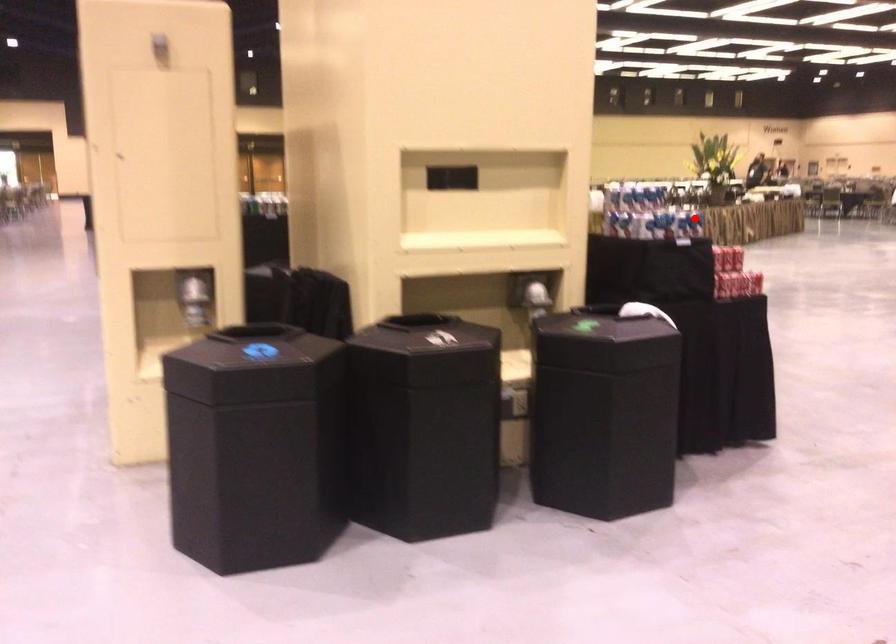
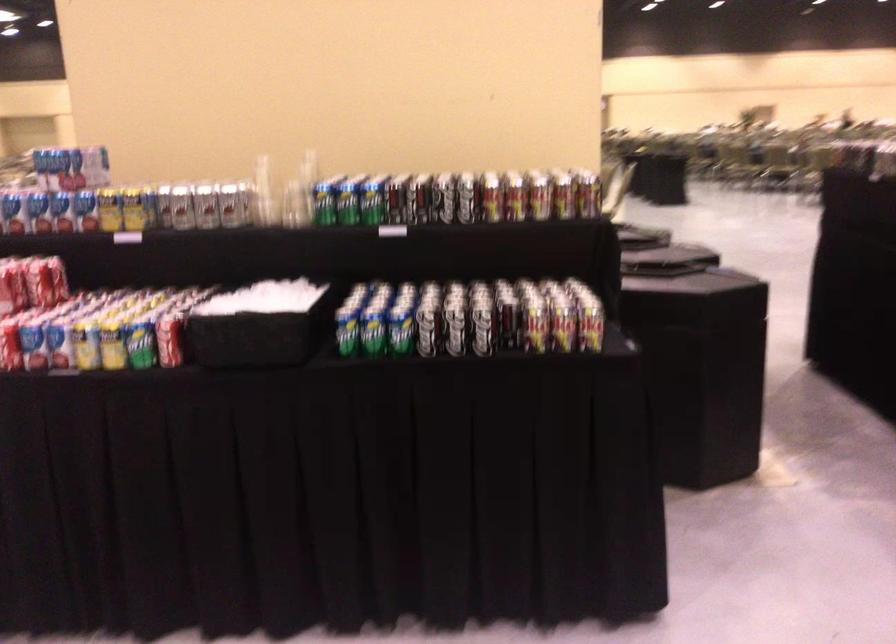
Question: A red point is marked in image1. In image2, is the corresponding 3D point closer to the camera or farther? Reply with the corresponding letter.

Choices:
 (A) The corresponding 3D point is closer.
 (B) The corresponding 3D point is farther.

Answer: (A)